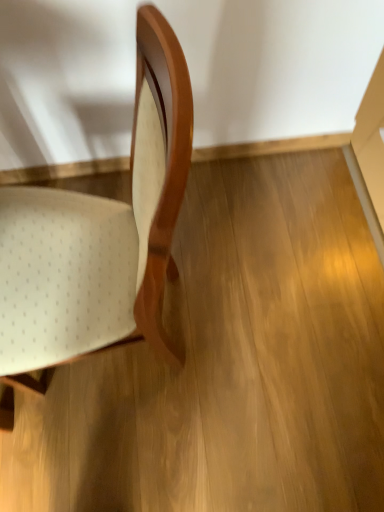
This screenshot has width=384, height=512. Describe the element at coordinates (99, 237) in the screenshot. I see `matte white chair at left` at that location.

What are the coordinates of `matte white chair at left` in the screenshot? It's located at (99, 237).

Identify the location of matte white chair at left. This screenshot has height=512, width=384. (99, 237).